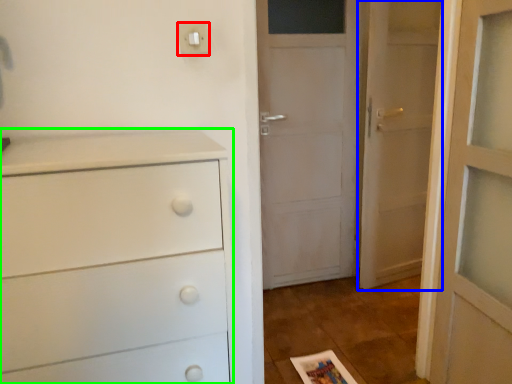
Question: Based on their relative distances, which object is farther from light switch (highlighted by a red box)? Choose from door (highlighted by a blue box) and chest of drawers (highlighted by a green box).

Choices:
 (A) door
 (B) chest of drawers

Answer: (A)